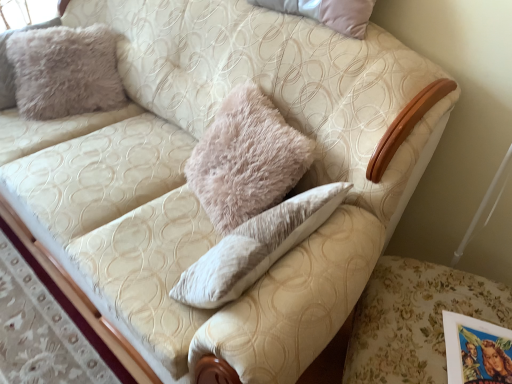
Where is `vacant region above floral fabric swivel chair at lower right (from a real-world perspective)`? vacant region above floral fabric swivel chair at lower right (from a real-world perspective) is located at coordinates (459, 325).